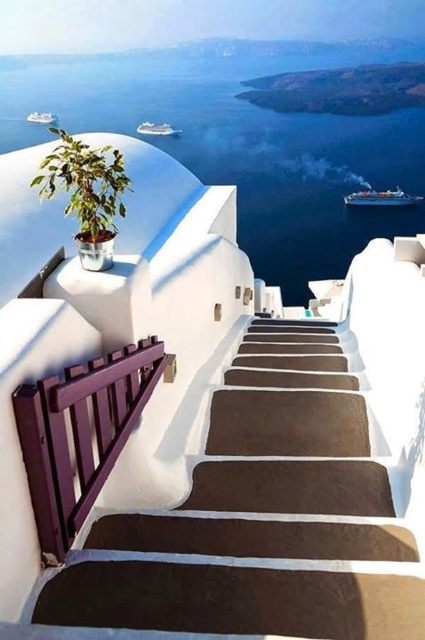
Question: Based on their relative distances, which object is farther from the blue water at upper center?

Choices:
 (A) green leafy plant at upper left
 (B) brown smooth stairs at center
 (C) shiny blue ship at upper right
 (D) white glossy boat at upper left

Answer: (B)

Question: Is the position of white glossy cruise ship at upper center more distant than that of white glossy boat at upper left?

Choices:
 (A) yes
 (B) no

Answer: (B)

Question: Can you confirm if blue water at upper center is wider than purple wood rail at left?

Choices:
 (A) no
 (B) yes

Answer: (B)

Question: Can you confirm if shiny blue ship at upper right is positioned below white glossy cruise ship at upper center?

Choices:
 (A) yes
 (B) no

Answer: (A)

Question: Which of the following is the closest to the observer?

Choices:
 (A) (30, 120)
 (B) (34, 458)
 (C) (175, 134)

Answer: (B)

Question: Which point is farther to the camera?

Choices:
 (A) (73, 161)
 (B) (387, 204)
 (C) (48, 116)
 (D) (272, 356)

Answer: (C)